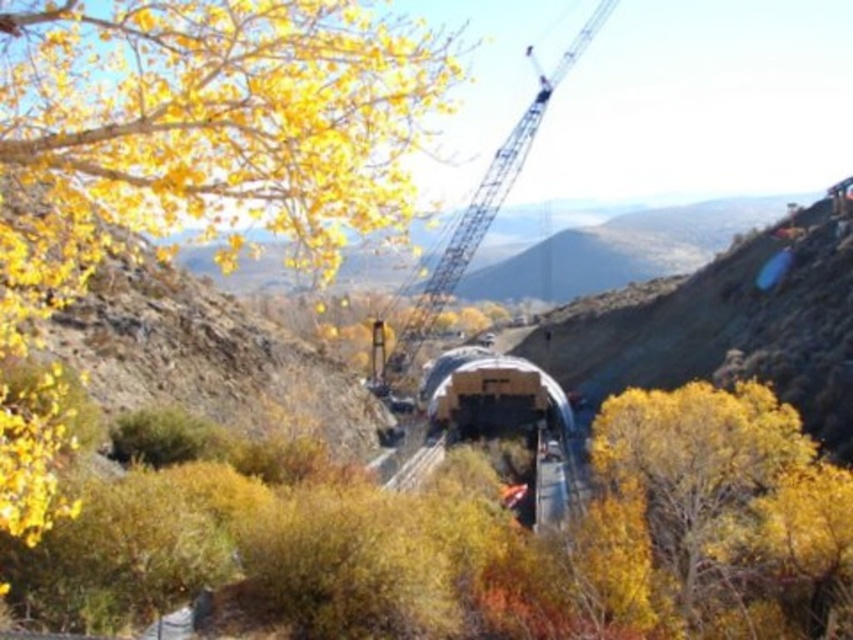
You are standing at the point marked by point (184, 156) in the image. What do you see directly in front of you?

You see a yellow leafy tree at upper left directly in front of you.